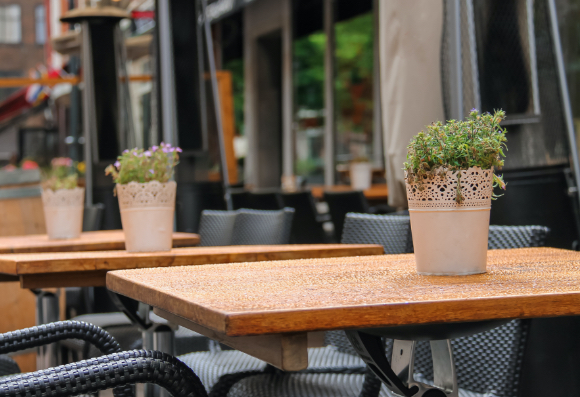
I want to click on tables, so click(355, 294), click(284, 293), click(67, 259), click(235, 250), click(111, 245), click(34, 243).